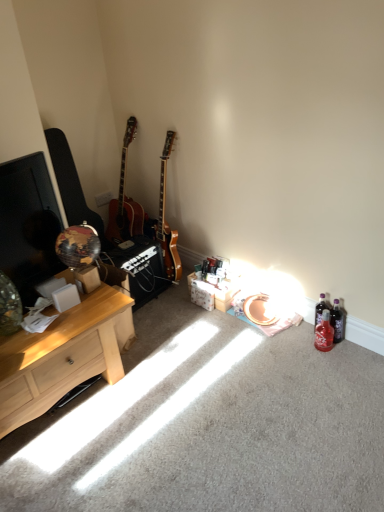
Question: Is light wood desk at left at the left side of white plastic power outlet at upper center?

Choices:
 (A) no
 (B) yes

Answer: (B)

Question: From the image's perspective, is light wood desk at left on white plastic power outlet at upper center?

Choices:
 (A) no
 (B) yes

Answer: (A)

Question: Does light wood desk at left have a greater width compared to white plastic power outlet at upper center?

Choices:
 (A) no
 (B) yes

Answer: (B)

Question: From a real-world perspective, is light wood desk at left located beneath white plastic power outlet at upper center?

Choices:
 (A) yes
 (B) no

Answer: (A)

Question: From the image's perspective, would you say light wood desk at left is shown under white plastic power outlet at upper center?

Choices:
 (A) yes
 (B) no

Answer: (A)

Question: Is white plastic power outlet at upper center surrounded by light wood desk at left?

Choices:
 (A) yes
 (B) no

Answer: (B)

Question: Is matte black guitar at left shorter than translucent plastic bottle at lower right, marked as the first bottle in a back-to-front arrangement?

Choices:
 (A) no
 (B) yes

Answer: (A)

Question: Can you confirm if matte black guitar at left is thinner than translucent plastic bottle at lower right, marked as the first bottle in a back-to-front arrangement?

Choices:
 (A) no
 (B) yes

Answer: (A)

Question: Is matte black guitar at left taller than translucent plastic bottle at lower right, placed as the second bottle when sorted from front to back?

Choices:
 (A) yes
 (B) no

Answer: (A)

Question: Is matte black guitar at left oriented towards translucent plastic bottle at lower right, placed as the second bottle when sorted from front to back?

Choices:
 (A) yes
 (B) no

Answer: (B)

Question: From a real-world perspective, is matte black guitar at left positioned under translucent plastic bottle at lower right, marked as the first bottle in a back-to-front arrangement, based on gravity?

Choices:
 (A) yes
 (B) no

Answer: (B)

Question: Is matte black guitar at left wider than translucent plastic bottle at lower right, placed as the second bottle when sorted from front to back?

Choices:
 (A) yes
 (B) no

Answer: (A)

Question: Is red glass bottle at lower right, acting as the first bottle starting from the front, at the right side of light wood desk at left?

Choices:
 (A) yes
 (B) no

Answer: (A)